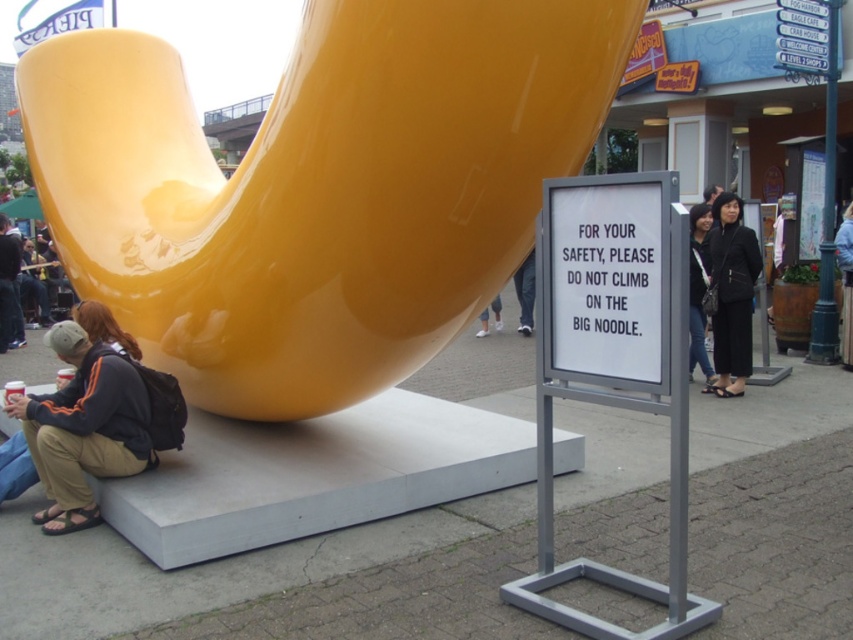
Can you confirm if glossy yellow slide at center is bigger than matte black jacket at lower left?

Correct, glossy yellow slide at center is larger in size than matte black jacket at lower left.

Between glossy yellow slide at center and matte black jacket at lower left, which one has more height?

With more height is glossy yellow slide at center.

Which is in front, point (492, 20) or point (18, 404)?

Point (492, 20) is more forward.

Image resolution: width=853 pixels, height=640 pixels. What are the coordinates of `glossy yellow slide at center` in the screenshot? It's located at (318, 188).

Who is positioned more to the right, glossy yellow slide at center or black fabric pants at right?

black fabric pants at right

Consider the image. Can you confirm if glossy yellow slide at center is bigger than black fabric pants at right?

Yes, glossy yellow slide at center is bigger than black fabric pants at right.

Between point (126, 77) and point (711, 392), which one is positioned behind?

Positioned behind is point (711, 392).

At what (x,y) coordinates should I click in order to perform the action: click on glossy yellow slide at center. Please return your answer as a coordinate pair (x, y). The image size is (853, 640). Looking at the image, I should click on (318, 188).

Can you confirm if black fabric pants at right is taller than dark gray fabric jacket at center?

Indeed, black fabric pants at right has a greater height compared to dark gray fabric jacket at center.

Based on the photo, can you confirm if black fabric pants at right is positioned to the right of dark gray fabric jacket at center?

Incorrect, black fabric pants at right is not on the right side of dark gray fabric jacket at center.

The image size is (853, 640). What do you see at coordinates (732, 294) in the screenshot?
I see `black fabric pants at right` at bounding box center [732, 294].

The width and height of the screenshot is (853, 640). Find the location of `black fabric pants at right`. black fabric pants at right is located at coordinates (732, 294).